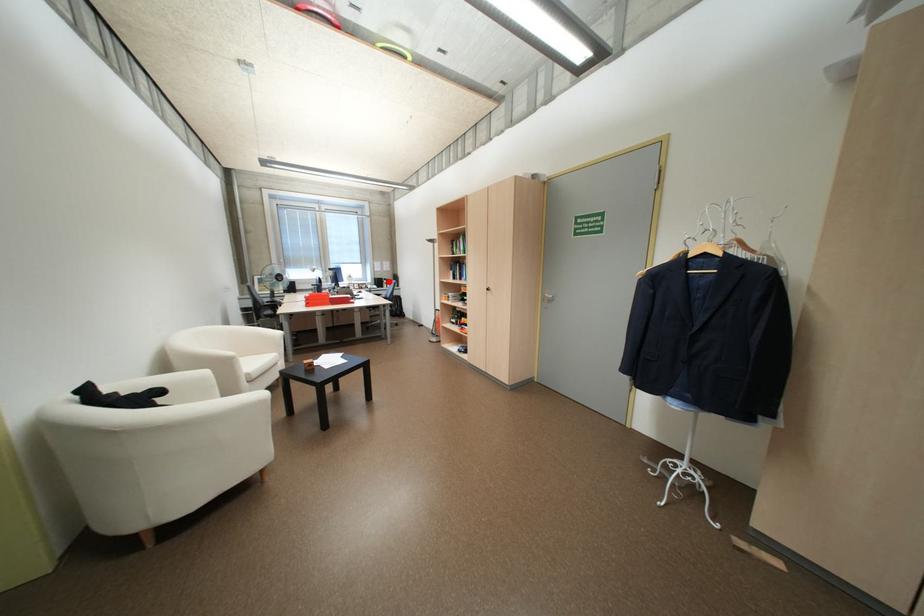
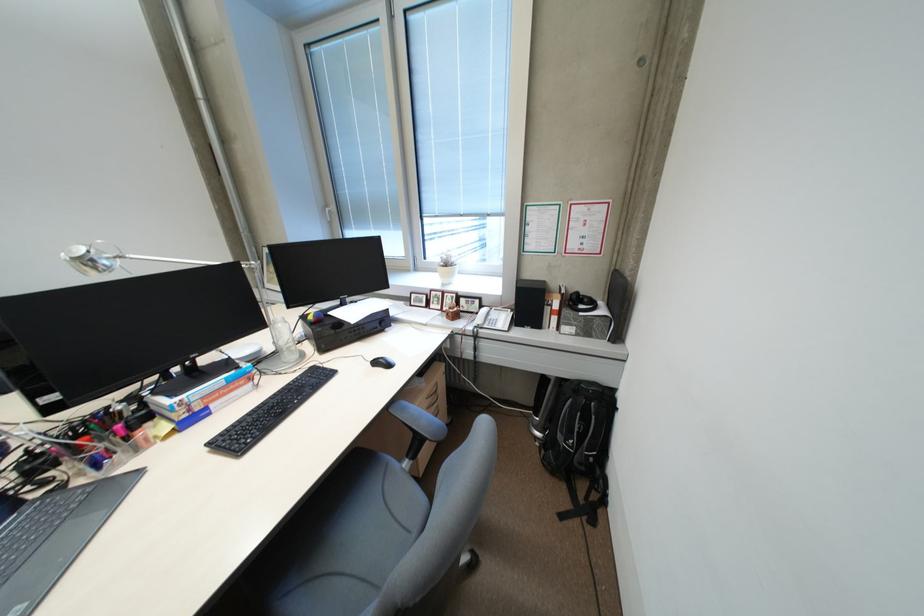
Where in the second image is the point corresponding to the highlighted location from the first image?

(538, 302)